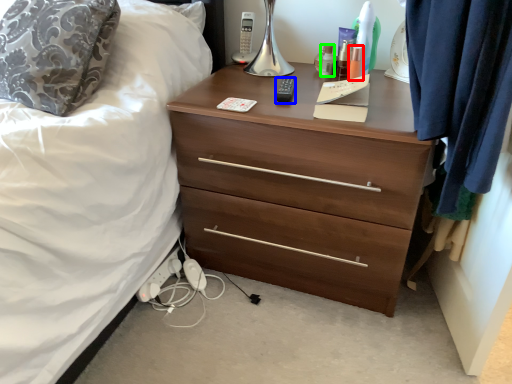
Question: Based on their relative distances, which object is farther from toiletry (highlighted by a red box)? Choose from remote control (highlighted by a blue box) and toiletry (highlighted by a green box).

Choices:
 (A) remote control
 (B) toiletry

Answer: (A)